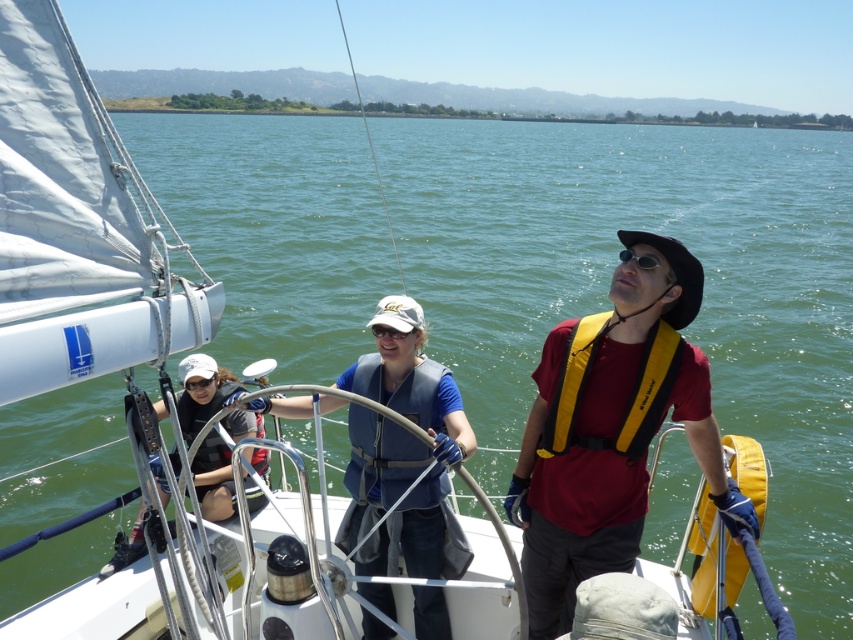
Question: Which point is closer to the camera?

Choices:
 (A) click(408, 333)
 (B) click(643, 259)
 (C) click(444, 484)
 (D) click(194, 419)

Answer: (B)

Question: Is blue fabric life vest at center to the right of sunglasses at center from the viewer's perspective?

Choices:
 (A) no
 (B) yes

Answer: (A)

Question: Does black fabric gloves at left come behind yellow/yellowish fabric life jacket at right?

Choices:
 (A) no
 (B) yes

Answer: (B)

Question: Among these points, which one is nearest to the camera?

Choices:
 (A) (202, 467)
 (B) (553, 499)
 (C) (370, 372)
 (D) (558, 369)

Answer: (D)

Question: Considering the relative positions of sunglasses at center and black rubber goggles at left in the image provided, where is sunglasses at center located with respect to black rubber goggles at left?

Choices:
 (A) left
 (B) right

Answer: (B)

Question: Which point is farther to the camera?

Choices:
 (A) (399, 336)
 (B) (213, 376)
 (C) (561, 332)

Answer: (B)